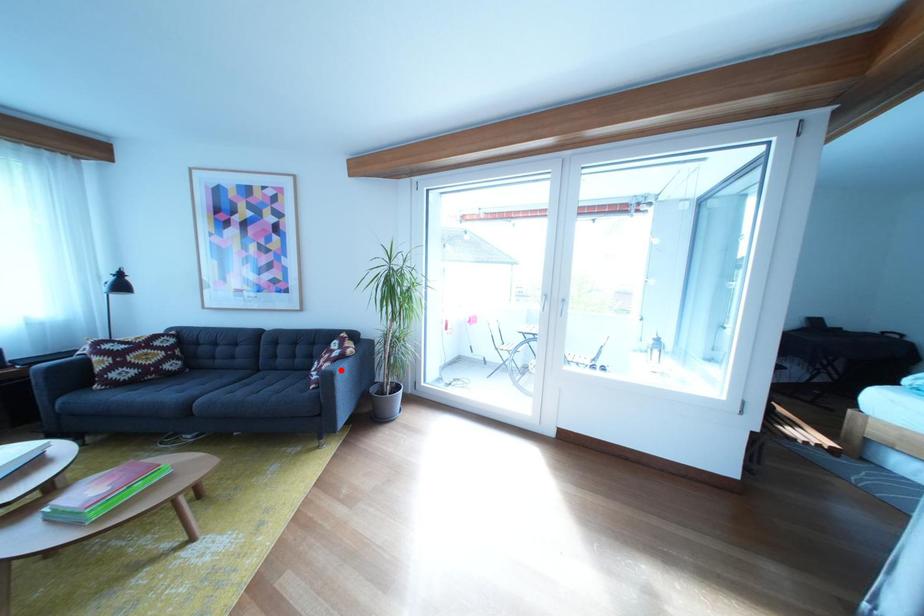
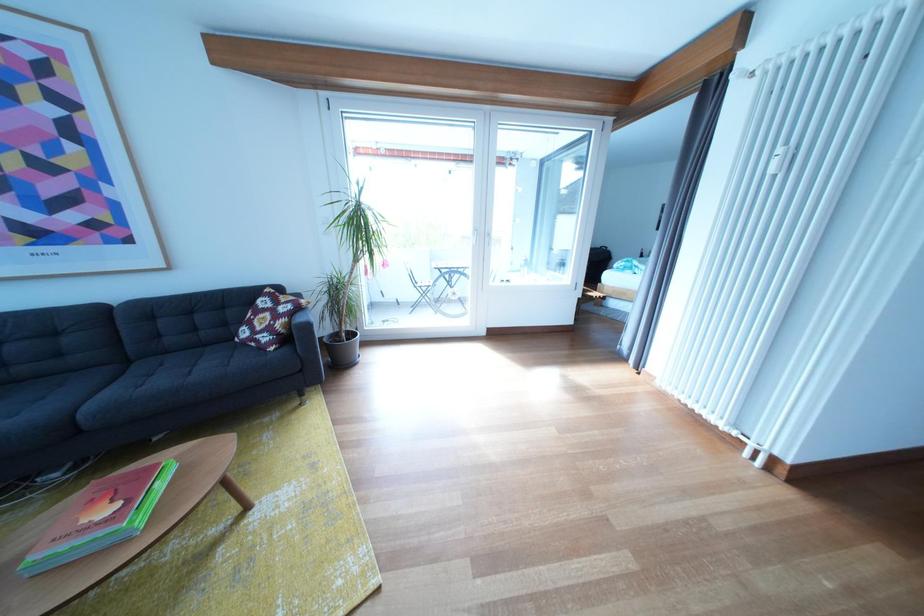
Question: I am providing you with two images of the same scene from different viewpoints. A red point is shown in image1. For the corresponding object point in image2, is it positioned nearer or farther from the camera?

Choices:
 (A) Nearer
 (B) Farther

Answer: (A)